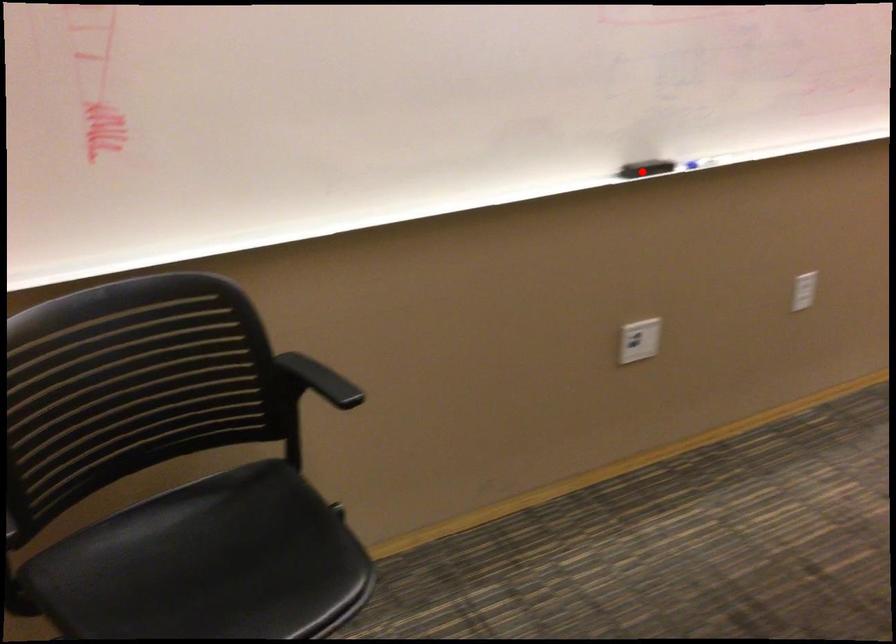
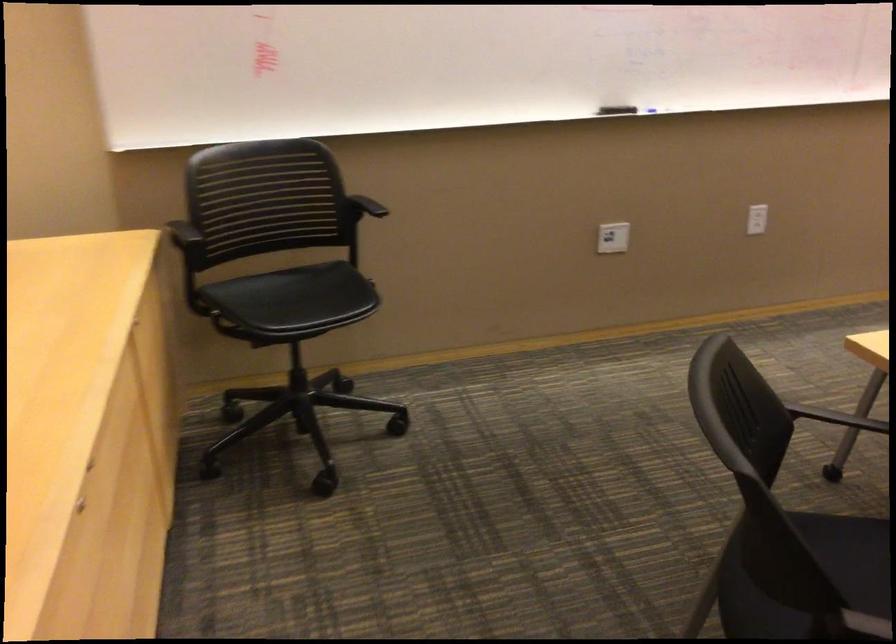
Find the pixel in the second image that matches the highlighted location in the first image.

(616, 109)